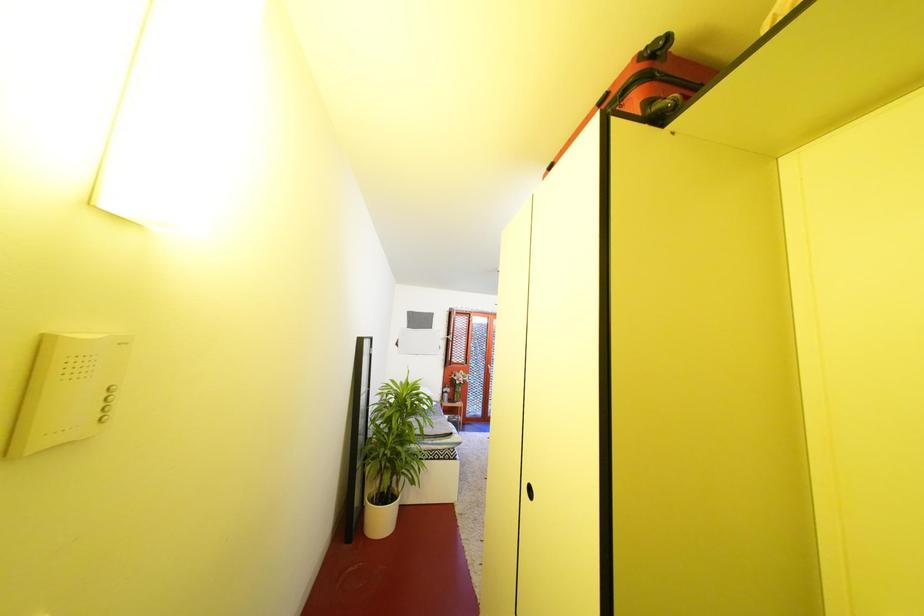
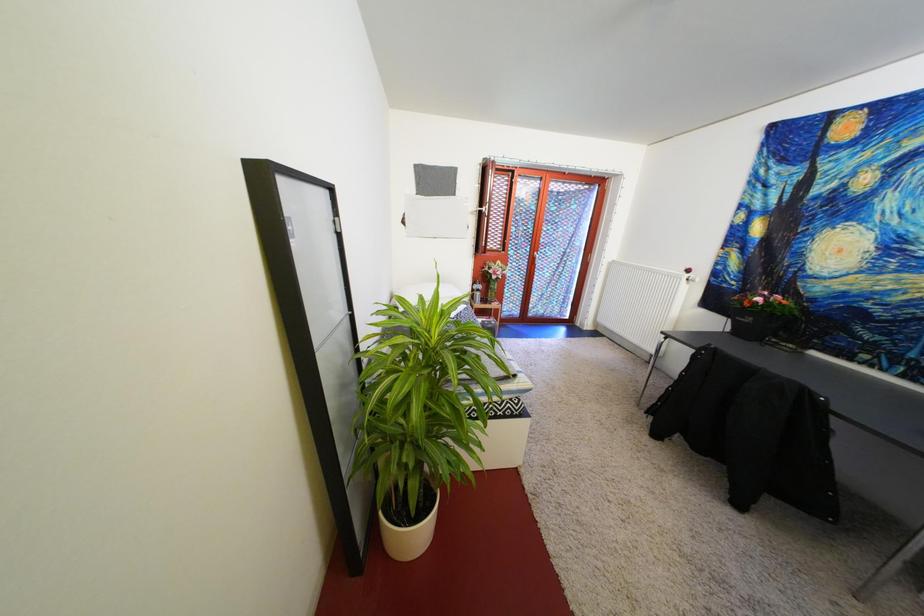
Question: The images are taken continuously from a first-person perspective. In which direction are you moving?

Choices:
 (A) Left
 (B) Right
 (C) Forward
 (D) Backward

Answer: (C)